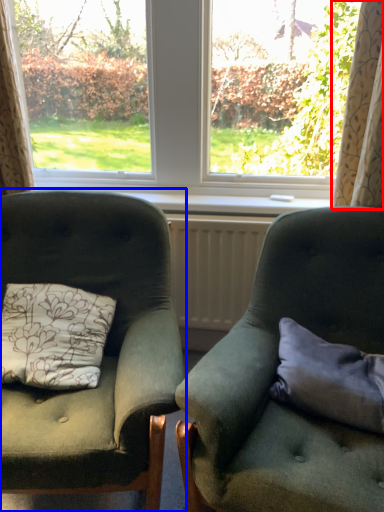
Question: Which of the following is the closest to the observer, curtain (highlighted by a red box) or chair (highlighted by a blue box)?

Choices:
 (A) curtain
 (B) chair

Answer: (B)